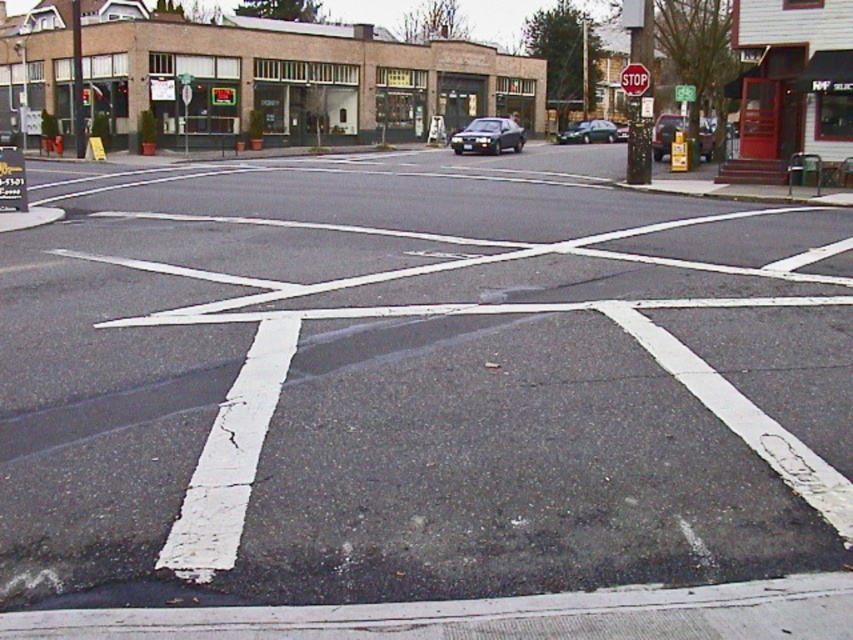
Question: Based on their relative distances, which object is farther from the shiny dark green sedan at center?

Choices:
 (A) green plastic sign at upper center
 (B) green glass traffic light at upper center
 (C) metallic gray sedan at center

Answer: (B)

Question: Is green plastic sign at upper center above green glass traffic light at upper center?

Choices:
 (A) yes
 (B) no

Answer: (B)

Question: Based on their relative distances, which object is farther from the shiny dark green sedan at center?

Choices:
 (A) green plastic sign at upper center
 (B) green glass traffic light at upper center

Answer: (B)

Question: Which object appears closest to the camera in this image?

Choices:
 (A) shiny dark green sedan at center
 (B) green glass traffic light at upper center
 (C) red metallic stop sign at upper center

Answer: (C)

Question: Can you confirm if metallic gray sedan at center is thinner than shiny dark green sedan at center?

Choices:
 (A) no
 (B) yes

Answer: (B)

Question: Is black asphalt at center smaller than shiny dark green sedan at center?

Choices:
 (A) no
 (B) yes

Answer: (A)